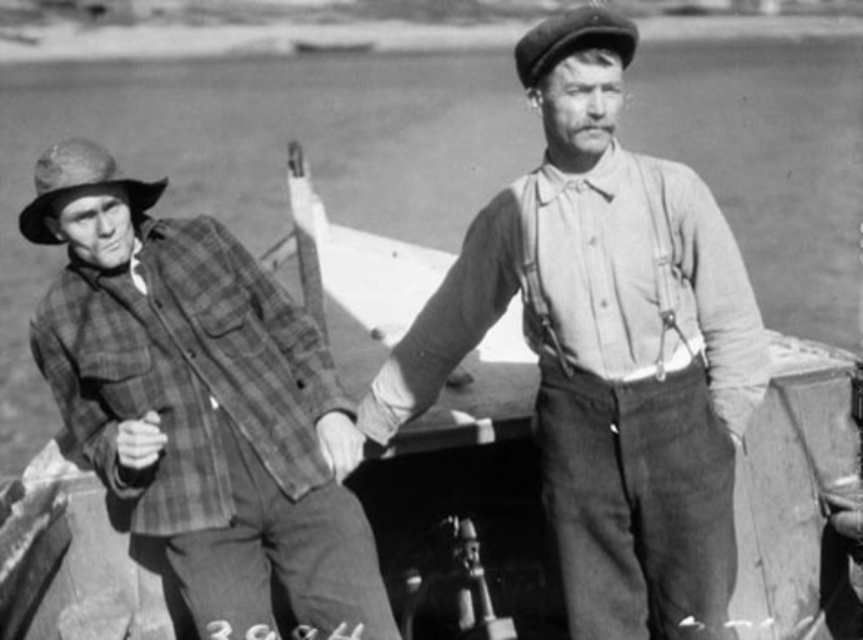
Is smooth cotton shirt at center positioned at the back of plaid fabric shirt at left?

No, it is in front of plaid fabric shirt at left.

Between smooth cotton shirt at center and plaid fabric shirt at left, which one appears on the right side from the viewer's perspective?

smooth cotton shirt at center is more to the right.

Which is behind, point (717, 472) or point (149, 497)?

Positioned behind is point (149, 497).

Where is `smooth cotton shirt at center`? smooth cotton shirt at center is located at coordinates (608, 346).